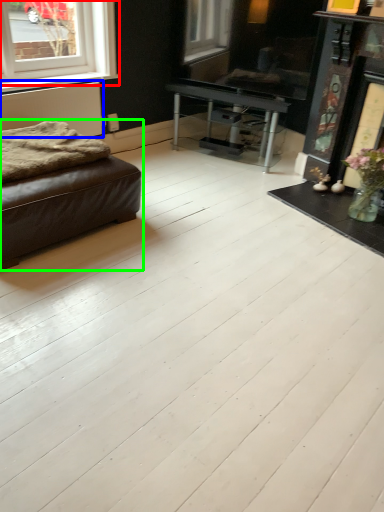
Question: Based on their relative distances, which object is farther from window (highlighted by a red box)? Choose from radiator (highlighted by a blue box) and studio couch (highlighted by a green box).

Choices:
 (A) radiator
 (B) studio couch

Answer: (B)